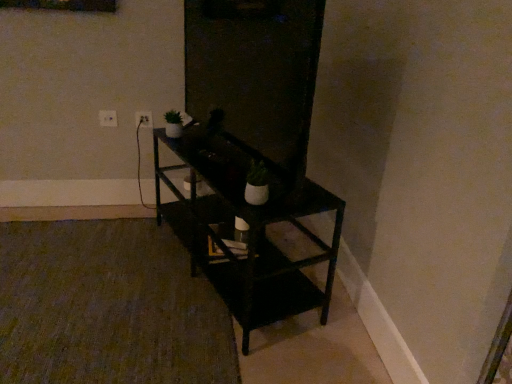
You are a GUI agent. You are given a task and a screenshot of the screen. Output one action in this format:
    pyautogui.click(x=<x>, y=<y>)
    Task: Click on the black matte shelf at center
    The image size is (512, 384).
    Given the screenshot: What is the action you would take?
    pyautogui.click(x=249, y=233)

Describe the element at coordinates (256, 74) in the screenshot. The image size is (512, 384). I see `transparent glass door at center` at that location.

What do you see at coordinates (257, 184) in the screenshot? The height and width of the screenshot is (384, 512). I see `white matte pot at center, the 2th houseplant when ordered from top to bottom` at bounding box center [257, 184].

This screenshot has height=384, width=512. I want to click on white plastic electric outlet at upper left, positioned as the 1th electric outlet in right-to-left order, so click(x=144, y=119).

From the image's perspective, would you say white matte pot at center, the 1th houseplant in the bottom-to-top sequence, is positioned over transparent glass door at center?

No, from the image's perspective, white matte pot at center, the 1th houseplant in the bottom-to-top sequence, is not on top of transparent glass door at center.

Can you confirm if white matte pot at center, arranged as the first houseplant when viewed from the front, is positioned to the left of transparent glass door at center?

Incorrect, white matte pot at center, arranged as the first houseplant when viewed from the front, is not on the left side of transparent glass door at center.

Is transparent glass door at center a part of white matte pot at center, the 1th houseplant positioned from the right?

No, transparent glass door at center is located outside of white matte pot at center, the 1th houseplant positioned from the right.

Considering the relative sizes of white plastic electric outlet at upper left, positioned as the 1th electric outlet in right-to-left order, and green matte houseplant at upper left, the second houseplant when ordered from bottom to top, in the image provided, is white plastic electric outlet at upper left, positioned as the 1th electric outlet in right-to-left order, taller than green matte houseplant at upper left, the second houseplant when ordered from bottom to top,?

No.

From a real-world perspective, which object stands above the other?

From a 3D spatial view, green matte houseplant at upper left, the second houseplant when ordered from bottom to top, is above.

Considering the relative sizes of white plastic electric outlet at upper left, positioned as the 1th electric outlet in right-to-left order, and green matte houseplant at upper left, positioned as the 2th houseplant in front-to-back order, in the image provided, is white plastic electric outlet at upper left, positioned as the 1th electric outlet in right-to-left order, thinner than green matte houseplant at upper left, positioned as the 2th houseplant in front-to-back order,?

Yes, white plastic electric outlet at upper left, positioned as the 1th electric outlet in right-to-left order, is thinner than green matte houseplant at upper left, positioned as the 2th houseplant in front-to-back order.

Is white plastic electric outlet at upper left, positioned as the 1th electric outlet in right-to-left order, facing towards green matte houseplant at upper left, the second houseplant positioned from the right?

Yes, white plastic electric outlet at upper left, positioned as the 1th electric outlet in right-to-left order, is aimed at green matte houseplant at upper left, the second houseplant positioned from the right.

Is point (179, 126) less distant than point (198, 99)?

No, (179, 126) is further to viewer.

Find the location of a particular element. This screenshot has width=512, height=384. the 1st houseplant below the transparent glass door at center (from the image's perspective) is located at coordinates (173, 124).

How distant is green matte houseplant at upper left, acting as the 1th houseplant starting from the back, from transparent glass door at center?

The distance of green matte houseplant at upper left, acting as the 1th houseplant starting from the back, from transparent glass door at center is 46.71 centimeters.

Is white plastic electric outlet at upper left, positioned as the 1th electric outlet in right-to-left order, looking in the opposite direction of white matte pot at center, the 1th houseplant in the bottom-to-top sequence?

white plastic electric outlet at upper left, positioned as the 1th electric outlet in right-to-left order, is not turned away from white matte pot at center, the 1th houseplant in the bottom-to-top sequence.

Considering the relative sizes of white plastic electric outlet at upper left, positioned as the 1th electric outlet in right-to-left order, and white matte pot at center, the 1th houseplant positioned from the right, in the image provided, is white plastic electric outlet at upper left, positioned as the 1th electric outlet in right-to-left order, smaller than white matte pot at center, the 1th houseplant positioned from the right,?

Yes, white plastic electric outlet at upper left, positioned as the 1th electric outlet in right-to-left order, is smaller than white matte pot at center, the 1th houseplant positioned from the right.

From a real-world perspective, which is physically above, white plastic electric outlet at upper left, positioned as the 1th electric outlet in right-to-left order, or white matte pot at center, the 1th houseplant in the bottom-to-top sequence?

From a 3D spatial view, white matte pot at center, the 1th houseplant in the bottom-to-top sequence, is above.

Does white plastic electric outlet at upper left, positioned as the 1th electric outlet in right-to-left order, appear on the left side of white matte pot at center, which is counted as the 2th houseplant, starting from the left?

Yes, white plastic electric outlet at upper left, positioned as the 1th electric outlet in right-to-left order, is to the left of white matte pot at center, which is counted as the 2th houseplant, starting from the left.

From the image's perspective, is white plastic electric outlet at upper left, which appears as the second electric outlet when viewed from the left, located beneath black matte shelf at center?

Incorrect, from the image's perspective, white plastic electric outlet at upper left, which appears as the second electric outlet when viewed from the left, is higher than black matte shelf at center.

Looking at the image, does white plastic electric outlet at upper left, positioned as the 1th electric outlet in right-to-left order, seem bigger or smaller compared to black matte shelf at center?

Considering their sizes, white plastic electric outlet at upper left, positioned as the 1th electric outlet in right-to-left order, takes up less space than black matte shelf at center.

Measure the distance from white plastic electric outlet at upper left, which appears as the second electric outlet when viewed from the left, to black matte shelf at center.

35.81 inches.

Which object is further away from the camera taking this photo, white plastic electric outlet at upper left, which appears as the second electric outlet when viewed from the left, or black matte shelf at center?

Positioned behind is white plastic electric outlet at upper left, which appears as the second electric outlet when viewed from the left.

Considering the sizes of green matte houseplant at upper left, positioned as the first houseplant in top-to-bottom order, and white matte pot at center, arranged as the first houseplant when viewed from the front, in the image, is green matte houseplant at upper left, positioned as the first houseplant in top-to-bottom order, taller or shorter than white matte pot at center, arranged as the first houseplant when viewed from the front,?

Considering their sizes, green matte houseplant at upper left, positioned as the first houseplant in top-to-bottom order, has less height than white matte pot at center, arranged as the first houseplant when viewed from the front.

How many degrees apart are the facing directions of green matte houseplant at upper left, positioned as the first houseplant in top-to-bottom order, and white matte pot at center, the 2th houseplant when ordered from top to bottom?

0.00642 degrees separate the facing orientations of green matte houseplant at upper left, positioned as the first houseplant in top-to-bottom order, and white matte pot at center, the 2th houseplant when ordered from top to bottom.

Between point (179, 134) and point (264, 181), which one is positioned in front?

The point (264, 181) is more forward.

At what (x,y) coordinates should I click in order to perform the action: click on houseplant lying above the white matte pot at center, the 1th houseplant positioned from the right (from the image's perspective). Please return your answer as a coordinate pair (x, y). The height and width of the screenshot is (384, 512). Looking at the image, I should click on (173, 124).

Between white plastic electric outlet at upper left, which is the 1th electric outlet from left to right, and white plastic electric outlet at upper left, which appears as the second electric outlet when viewed from the left, which one has larger size?

With larger size is white plastic electric outlet at upper left, which is the 1th electric outlet from left to right.

Is white plastic electric outlet at upper left, the second electric outlet viewed from the right, to the left of white plastic electric outlet at upper left, which appears as the second electric outlet when viewed from the left, from the viewer's perspective?

Yes, white plastic electric outlet at upper left, the second electric outlet viewed from the right, is to the left of white plastic electric outlet at upper left, which appears as the second electric outlet when viewed from the left.

Between white plastic electric outlet at upper left, the second electric outlet viewed from the right, and white plastic electric outlet at upper left, which appears as the second electric outlet when viewed from the left, which one is positioned behind?

Positioned behind is white plastic electric outlet at upper left, which appears as the second electric outlet when viewed from the left.

From the image's perspective, relative to white plastic electric outlet at upper left, which appears as the second electric outlet when viewed from the left, is white plastic electric outlet at upper left, the second electric outlet viewed from the right, above or below?

white plastic electric outlet at upper left, the second electric outlet viewed from the right, is below white plastic electric outlet at upper left, which appears as the second electric outlet when viewed from the left.

Locate an element on the screen. This screenshot has width=512, height=384. houseplant on the right of transparent glass door at center is located at coordinates (257, 184).

From the image's perspective, starting from the white plastic electric outlet at upper left, positioned as the 1th electric outlet in right-to-left order, which houseplant is the 1st one below? Please provide its 2D coordinates.

[(173, 124)]

From the image, which object appears to be farther from white matte pot at center, the 1th houseplant positioned from the right, black matte shelf at center or white plastic electric outlet at upper left, positioned as the 1th electric outlet in right-to-left order?

The object further to white matte pot at center, the 1th houseplant positioned from the right, is white plastic electric outlet at upper left, positioned as the 1th electric outlet in right-to-left order.

Based on their spatial positions, is black matte shelf at center or white matte pot at center, which is counted as the 2th houseplant, starting from the left, closer to transparent glass door at center?

The object closer to transparent glass door at center is black matte shelf at center.

Which object lies nearer to the anchor point transparent glass door at center, black matte shelf at center or white plastic electric outlet at upper left, positioned as the 1th electric outlet in right-to-left order?

black matte shelf at center is positioned closer to the anchor transparent glass door at center.

When comparing their distances from white plastic electric outlet at upper left, which is the 1th electric outlet from left to right, does white matte pot at center, the 1th houseplant positioned from the right, or green matte houseplant at upper left, the second houseplant when ordered from bottom to top, seem closer?

Among the two, green matte houseplant at upper left, the second houseplant when ordered from bottom to top, is located nearer to white plastic electric outlet at upper left, which is the 1th electric outlet from left to right.

When comparing their distances from green matte houseplant at upper left, the second houseplant when ordered from bottom to top, does white plastic electric outlet at upper left, which appears as the second electric outlet when viewed from the left, or black matte shelf at center seem further?

Based on the image, black matte shelf at center appears to be further to green matte houseplant at upper left, the second houseplant when ordered from bottom to top.

Based on their spatial positions, is white plastic electric outlet at upper left, which appears as the second electric outlet when viewed from the left, or white matte pot at center, the 2th houseplant in the back-to-front sequence, further from black matte shelf at center?

Among the two, white plastic electric outlet at upper left, which appears as the second electric outlet when viewed from the left, is located further to black matte shelf at center.

Based on their spatial positions, is black matte shelf at center or transparent glass door at center closer to white plastic electric outlet at upper left, which appears as the second electric outlet when viewed from the left?

The object closer to white plastic electric outlet at upper left, which appears as the second electric outlet when viewed from the left, is transparent glass door at center.

Looking at the image, which one is located closer to white matte pot at center, the 2th houseplant when ordered from top to bottom, white plastic electric outlet at upper left, positioned as the 1th electric outlet in right-to-left order, or black matte shelf at center?

The object closer to white matte pot at center, the 2th houseplant when ordered from top to bottom, is black matte shelf at center.

The height and width of the screenshot is (384, 512). In order to click on houseplant positioned between white matte pot at center, the 2th houseplant in the back-to-front sequence, and white plastic electric outlet at upper left, the second electric outlet viewed from the right, from near to far in this screenshot , I will do `click(173, 124)`.

Locate an element on the screen. Image resolution: width=512 pixels, height=384 pixels. electric outlet positioned between white matte pot at center, the 1th houseplant positioned from the right, and white plastic electric outlet at upper left, positioned as the 1th electric outlet in right-to-left order, from near to far is located at coordinates (108, 118).

Where is `houseplant between black matte shelf at center and green matte houseplant at upper left, acting as the 1th houseplant starting from the back, along the z-axis`? Image resolution: width=512 pixels, height=384 pixels. houseplant between black matte shelf at center and green matte houseplant at upper left, acting as the 1th houseplant starting from the back, along the z-axis is located at coordinates (257, 184).

The height and width of the screenshot is (384, 512). Identify the location of shelf located between transparent glass door at center and white plastic electric outlet at upper left, which appears as the second electric outlet when viewed from the left, in the depth direction. (249, 233).